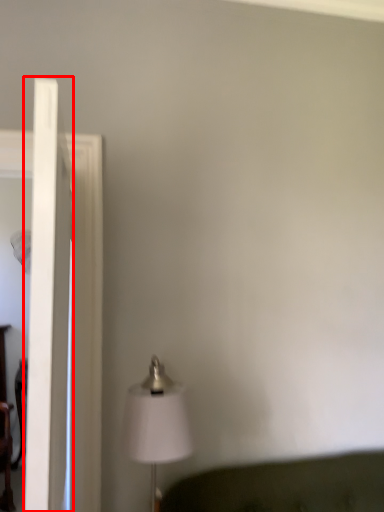
Question: From the image's perspective, where is glass door (annotated by the red box) located relative to lamp?

Choices:
 (A) below
 (B) above

Answer: (B)